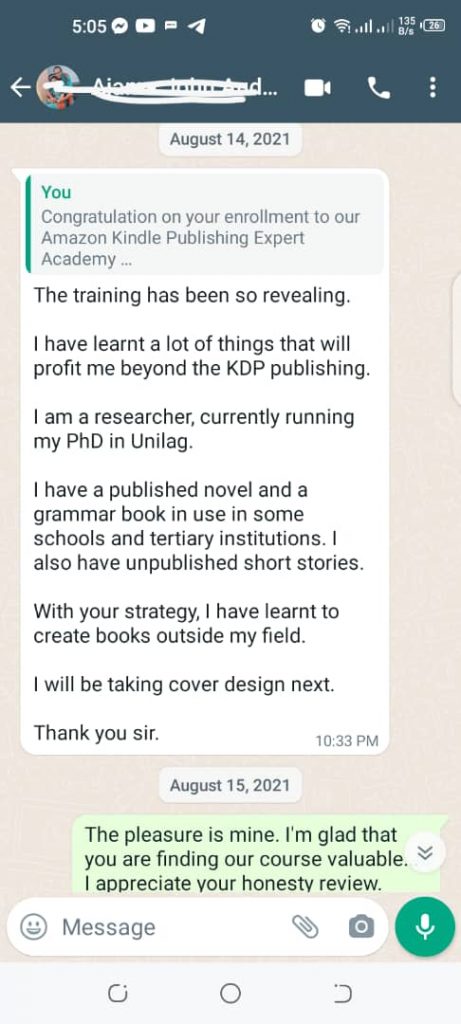
At what (x,y) coordinates should I click in order to perform the action: click on phone. Please return your answer as a coordinate pair (x, y). The height and width of the screenshot is (1024, 461). Looking at the image, I should click on (378, 91).